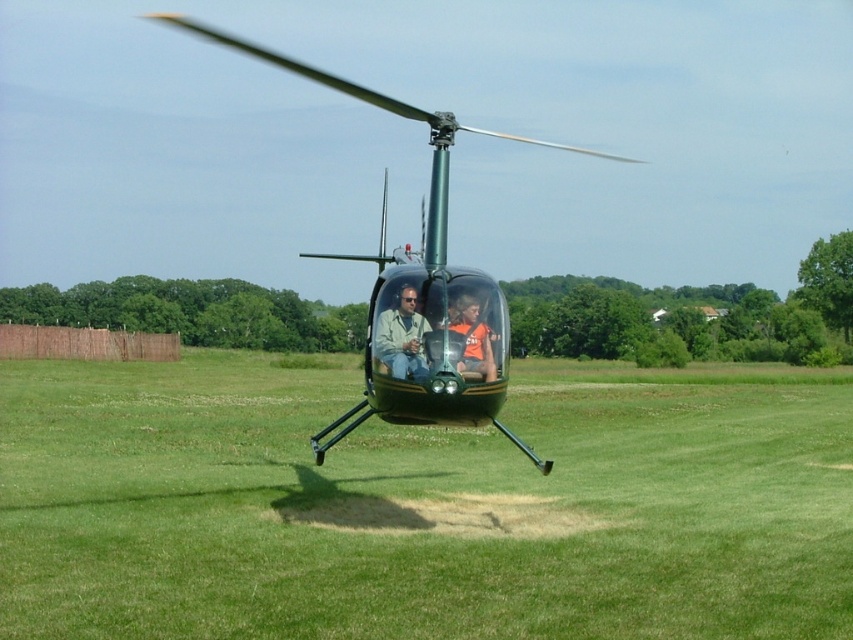
Which is above, green grass at center or orange jersey at center?

Positioned higher is orange jersey at center.

Is green grass at center positioned behind orange jersey at center?

That is False.

Which is in front, point (712, 484) or point (485, 332)?

Point (485, 332) is in front.

Where is `green grass at center`? This screenshot has height=640, width=853. green grass at center is located at coordinates (421, 506).

Is green glossy helicopter at center positioned at the back of matte green helicopter at center?

Yes, green glossy helicopter at center is behind matte green helicopter at center.

Between green glossy helicopter at center and matte green helicopter at center, which one has more height?

Standing taller between the two is green glossy helicopter at center.

Measure the distance between point (x=433, y=353) and camera.

A distance of 41.50 feet exists between point (x=433, y=353) and camera.

I want to click on green glossy helicopter at center, so tap(416, 282).

Is green grass at center below matte green helicopter at center?

Correct, green grass at center is located below matte green helicopter at center.

Does green grass at center appear on the right side of matte green helicopter at center?

No, green grass at center is not to the right of matte green helicopter at center.

Which is behind, point (825, 456) or point (395, 310)?

The point (825, 456) is more distant.

The width and height of the screenshot is (853, 640). In order to click on green grass at center in this screenshot , I will do `click(421, 506)`.